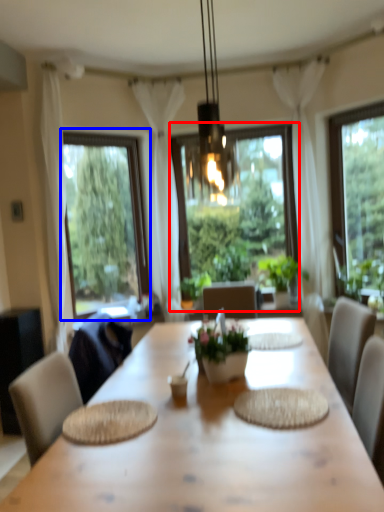
Question: Among these objects, which one is farthest to the camera, window (highlighted by a red box) or window (highlighted by a blue box)?

Choices:
 (A) window
 (B) window

Answer: (A)